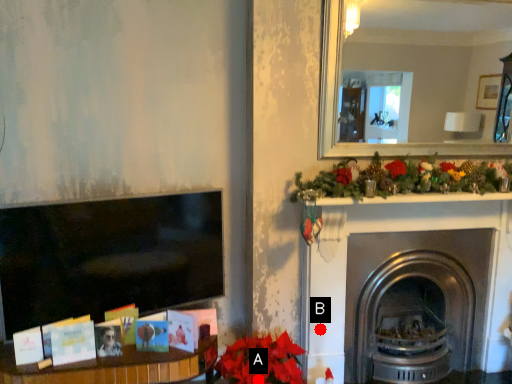
Question: Two points are circled on the image, labeled by A and B beside each circle. Which point is closer to the camera?

Choices:
 (A) A is closer
 (B) B is closer

Answer: (A)